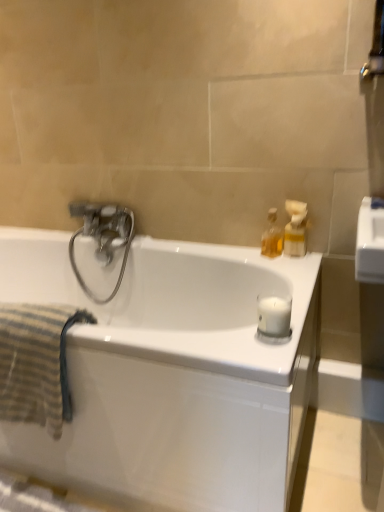
The height and width of the screenshot is (512, 384). I want to click on vacant space that is to the left of translucent plastic soap dispenser at upper right, which is counted as the 1th soap dispenser, starting from the right, so click(x=253, y=256).